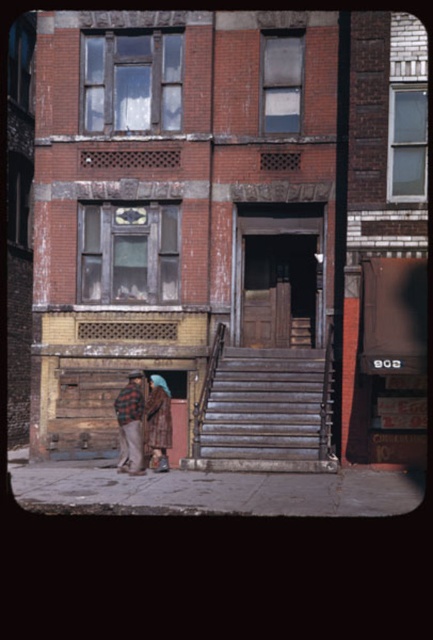
You are standing at the bottom of the stairs leading to the entrance of the building. You notice two points marked on the building wall. The first point is at coordinate point [283,428], and the second is at point [149,380]. Which of these points is closer to you as you stand at the base of the stairs?

Point [149,380] is closer to you because it is behind point [283,428], meaning the latter is further away from your current position at the base of the stairs.

You are a delivery person carrying a large package that is 2 meters wide. You need to navigate through the rusty metal stairs at center and the plaid flannel shirt at lower left. Which path is wider and can accommodate your package?

The rusty metal stairs at center is wider than the plaid flannel shirt at lower left, so the package can fit through the rusty metal stairs at center.

You are standing at the base of the stairs leading to the entrance of the two story brick building. You want to reach the point at coordinates point (119, 426). Can you walk directly to it from your current position?

The point (119, 426) is 47.75 feet from camera, so yes, you can walk directly to it from your current position as it is within a reachable distance.